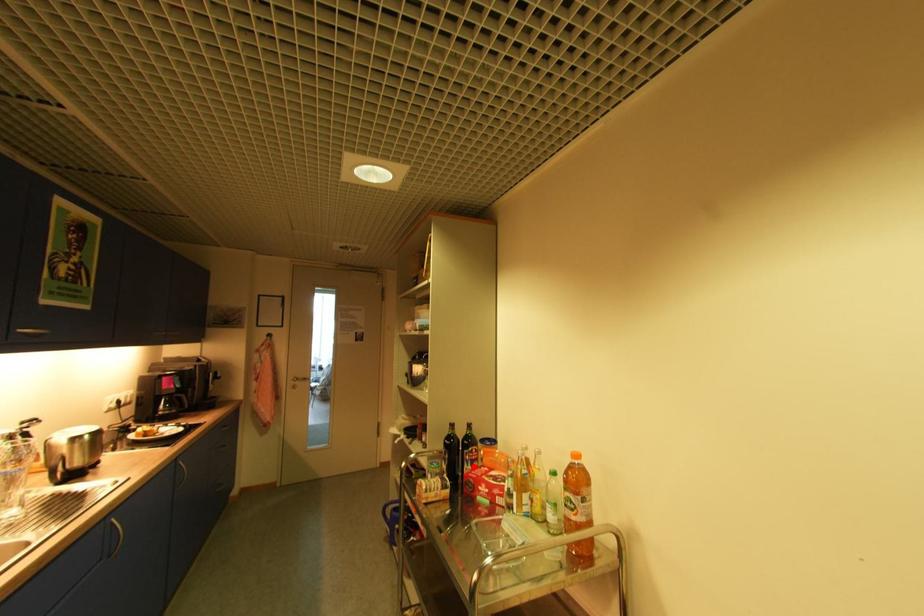
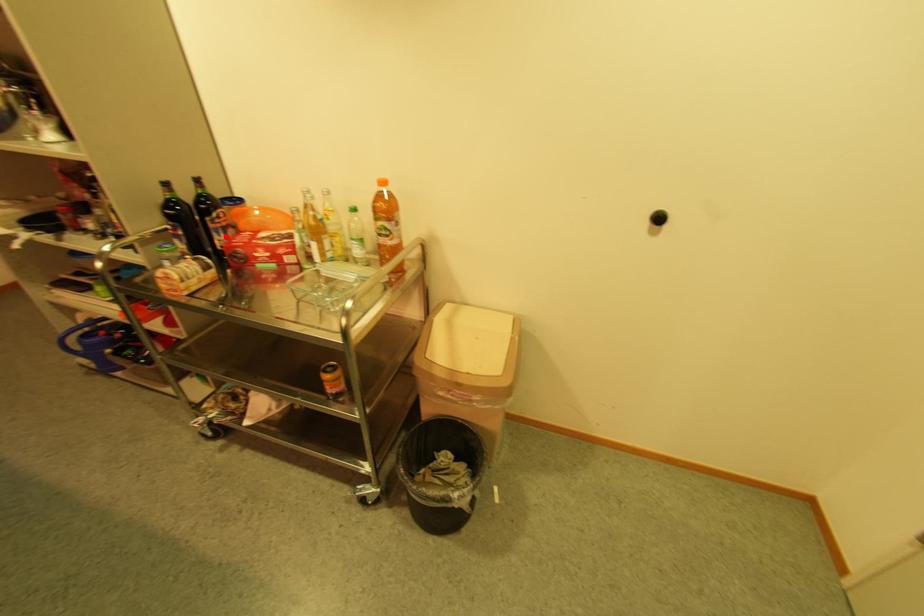
I am providing you with two images of the same scene from different viewpoints. A red point is marked on the first image and another point is marked on the second image. Do the highlighted points in image1 and image2 indicate the same real-world spot?

Yes